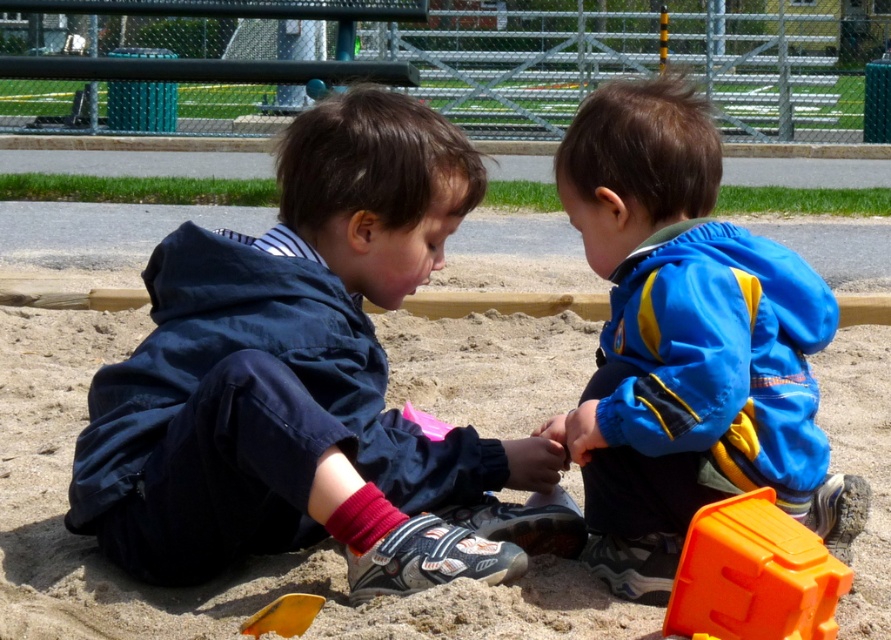
Question: Which point is farther to the camera?

Choices:
 (A) dark blue jacket at center
 (B) pink plastic shovel at center

Answer: (B)

Question: Does fine-grained sand at center appear on the left side of blue/yellow fabric jacket at right?

Choices:
 (A) yes
 (B) no

Answer: (A)

Question: Which of the following is the farthest from the observer?

Choices:
 (A) (309, 376)
 (B) (422, 412)
 (C) (710, 513)
 (D) (252, 616)

Answer: (B)

Question: Can you confirm if fine-grained sand at center is smaller than pink plastic shovel at center?

Choices:
 (A) yes
 (B) no

Answer: (B)

Question: Which of the following is the closest to the observer?

Choices:
 (A) orange plastic shovel at lower left
 (B) orange plastic toy at lower right
 (C) blue/yellow fabric jacket at right
 (D) fine-grained sand at center

Answer: (B)

Question: Can you confirm if dark blue jacket at center is bigger than fine-grained sand at center?

Choices:
 (A) yes
 (B) no

Answer: (A)